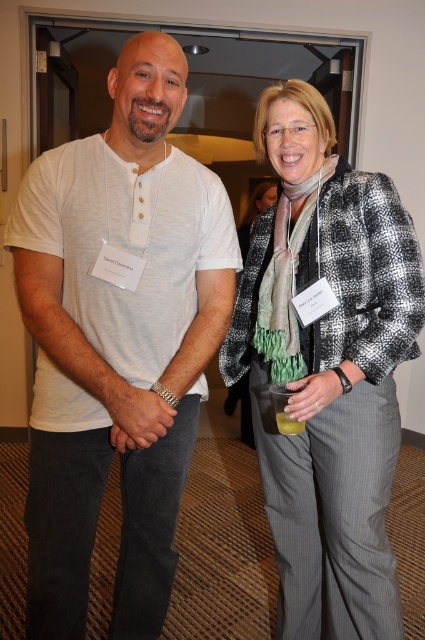
Is white cotton t-shirt at center wider than black and white checkered jacket at center?

Indeed, white cotton t-shirt at center has a greater width compared to black and white checkered jacket at center.

Which is below, white cotton t-shirt at center or black and white checkered jacket at center?

black and white checkered jacket at center

This screenshot has width=425, height=640. Find the location of `white cotton t-shirt at center`. white cotton t-shirt at center is located at coordinates (118, 340).

The image size is (425, 640). I want to click on white cotton t-shirt at center, so click(x=118, y=340).